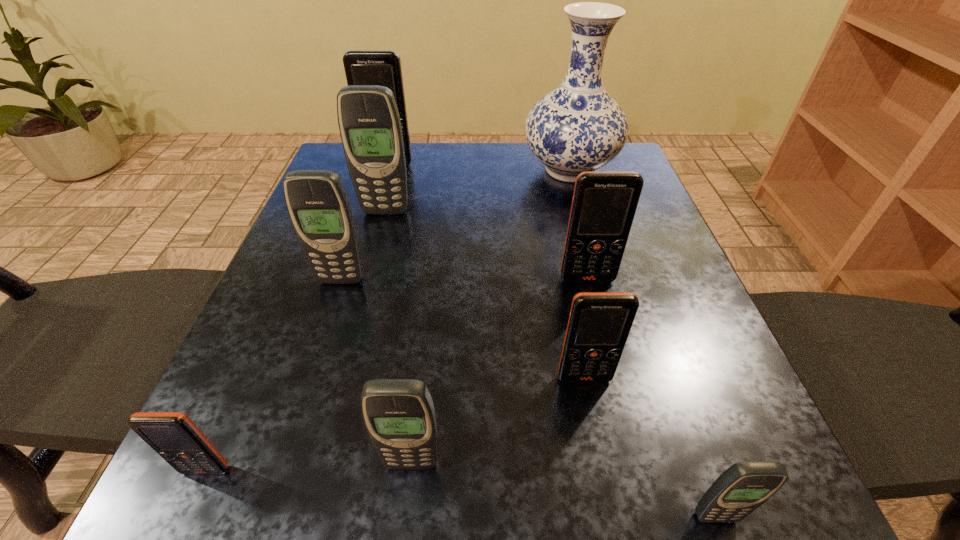
The height and width of the screenshot is (540, 960). Find the location of `the fourth nearest cellular telephone`. the fourth nearest cellular telephone is located at coordinates (599, 323).

The height and width of the screenshot is (540, 960). What are the coordinates of `the fourth nearest object` in the screenshot? It's located at (599, 323).

The height and width of the screenshot is (540, 960). Find the location of `the nearest orange cellular telephone`. the nearest orange cellular telephone is located at coordinates (173, 435).

You are a GUI agent. You are given a task and a screenshot of the screen. Output one action in this format:
    pyautogui.click(x=<x>, y=<y>)
    Task: Click on the smallest orange cellular telephone
    
    Given the screenshot: What is the action you would take?
    pyautogui.click(x=173, y=435)

Find the location of a particular element. the rightmost cellular telephone is located at coordinates (x=742, y=488).

Identify the location of the nearest object. (742, 488).

Locate an element on the screen. The width and height of the screenshot is (960, 540). vacant position located 0.190m on the front of the tallest object is located at coordinates (592, 251).

Locate an element on the screen. The image size is (960, 540). free space located on the screen of the biggest orange cellular telephone is located at coordinates (372, 224).

Image resolution: width=960 pixels, height=540 pixels. I want to click on vacant space situated 0.070m on the screen of the seventh nearest object, so click(x=379, y=235).

Identify the location of vacant space situated 0.370m on the screen of the second farthest orange cellular telephone. (642, 500).